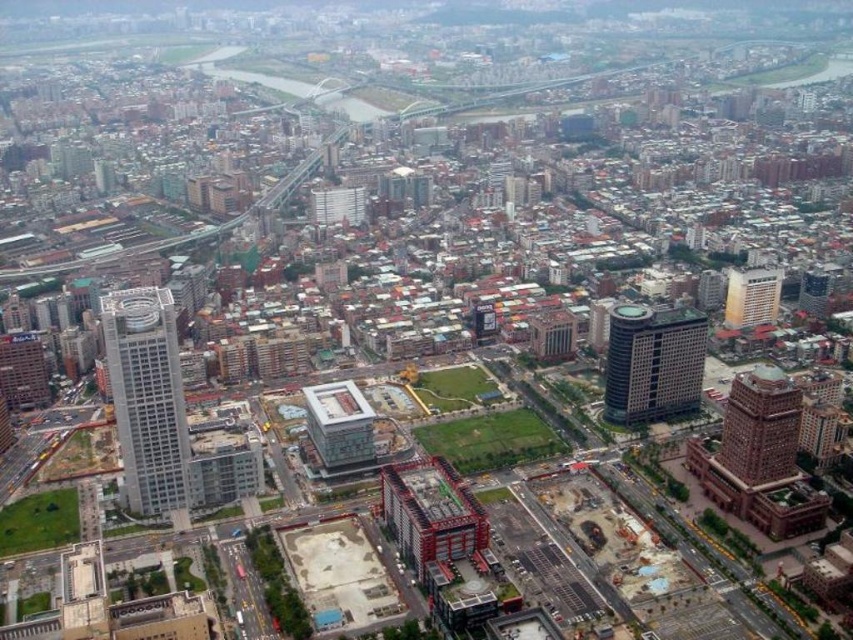
Based on the photo, you are a drone operator flying over the city. You notice the white concrete building at center and the matte gray building at center. Which one is closer to your drone?

The white concrete building at center is closer to the drone because it is positioned in front of the matte gray building at center.

You are a city planner reviewing this urban layout. You need to decide which of the two buildings, the white concrete building at center or the matte gray building at center, has a narrower width. Which one is it?

The white concrete building at center is thinner than matte gray building at center, so it has a narrower width.

You are a drone operator flying over the city. You see two points marked in the scene. According to the coordinates, which point is closer to you, the point at (x=166, y=298) or the point at (x=648, y=316)?

Point at (x=166, y=298) is closer to you because it is in front of the point at (x=648, y=316).